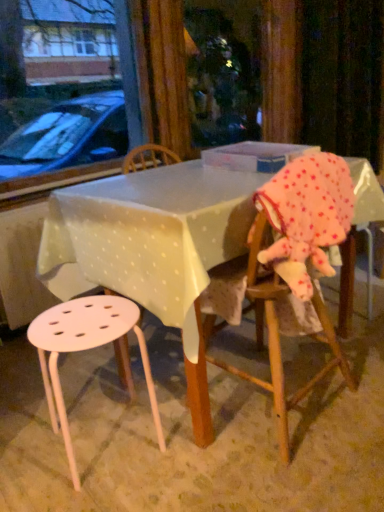
Find the location of `vacant space in between white plastic stool at lower left and white plastic table at center`. vacant space in between white plastic stool at lower left and white plastic table at center is located at coordinates (124, 475).